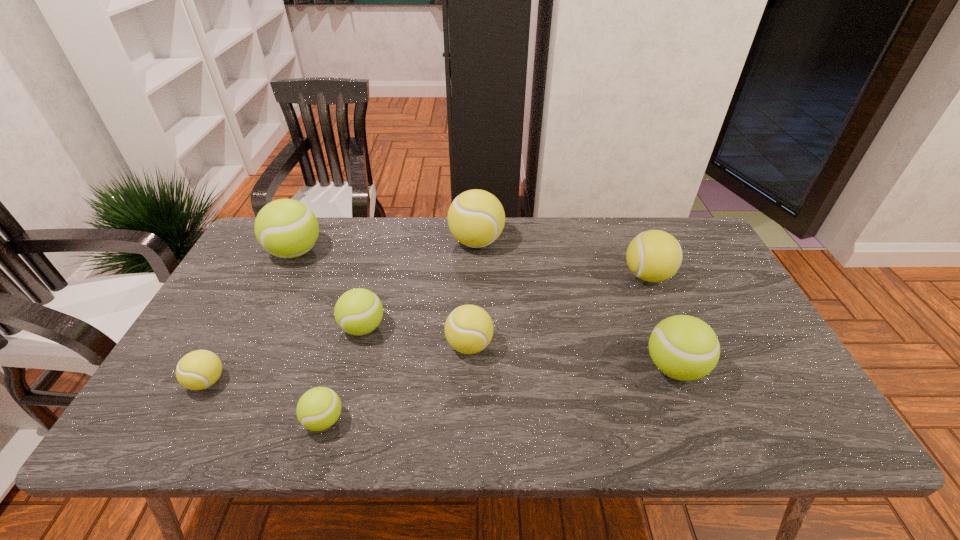
Where is `empty location between the second smallest yellow tennis ball and the farthest green tennis ball`? empty location between the second smallest yellow tennis ball and the farthest green tennis ball is located at coordinates (382, 299).

This screenshot has width=960, height=540. I want to click on free space between the rightmost green tennis ball and the third biggest green tennis ball, so click(x=518, y=348).

Find the location of a particular element. The image size is (960, 540). empty space between the third biggest green tennis ball and the third smallest yellow tennis ball is located at coordinates (505, 302).

Locate an element on the screen. empty space that is in between the leftmost green tennis ball and the biggest yellow tennis ball is located at coordinates tap(386, 247).

Locate an element on the screen. blank region between the rightmost yellow tennis ball and the third biggest yellow tennis ball is located at coordinates (559, 310).

Identify the location of empty space that is in between the third farthest yellow tennis ball and the third biggest green tennis ball. (417, 336).

You are a GUI agent. You are given a task and a screenshot of the screen. Output one action in this format:
    pyautogui.click(x=<x>, y=<y>)
    Task: Click on the free space between the second smallest green tennis ball and the nearest yellow tennis ball
    This screenshot has width=960, height=540.
    Given the screenshot: What is the action you would take?
    (285, 355)

Find the location of a particular element. The width and height of the screenshot is (960, 540). unoccupied position between the third biggest green tennis ball and the third smallest green tennis ball is located at coordinates (518, 348).

Locate an element on the screen. This screenshot has width=960, height=540. unoccupied area between the biggest yellow tennis ball and the third smallest green tennis ball is located at coordinates (575, 305).

The image size is (960, 540). What are the coordinates of `free area in between the third smallest yellow tennis ball and the rightmost green tennis ball` in the screenshot? It's located at (660, 322).